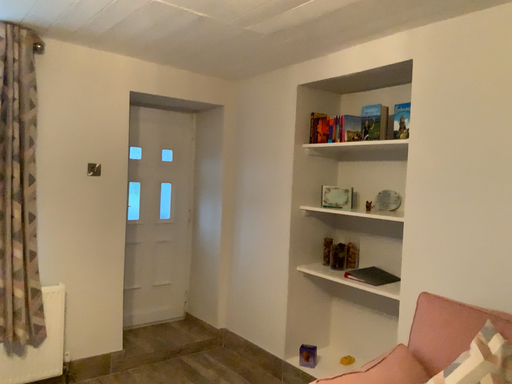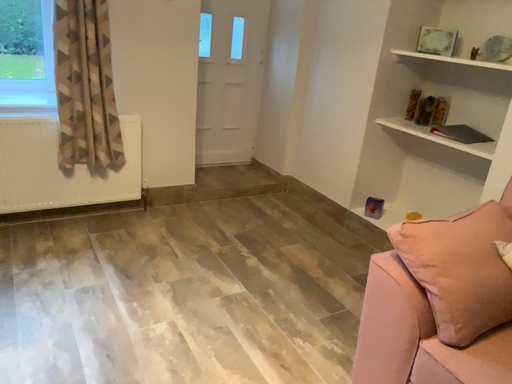
Question: How did the camera likely rotate when shooting the video?

Choices:
 (A) rotated downward
 (B) rotated upward

Answer: (A)